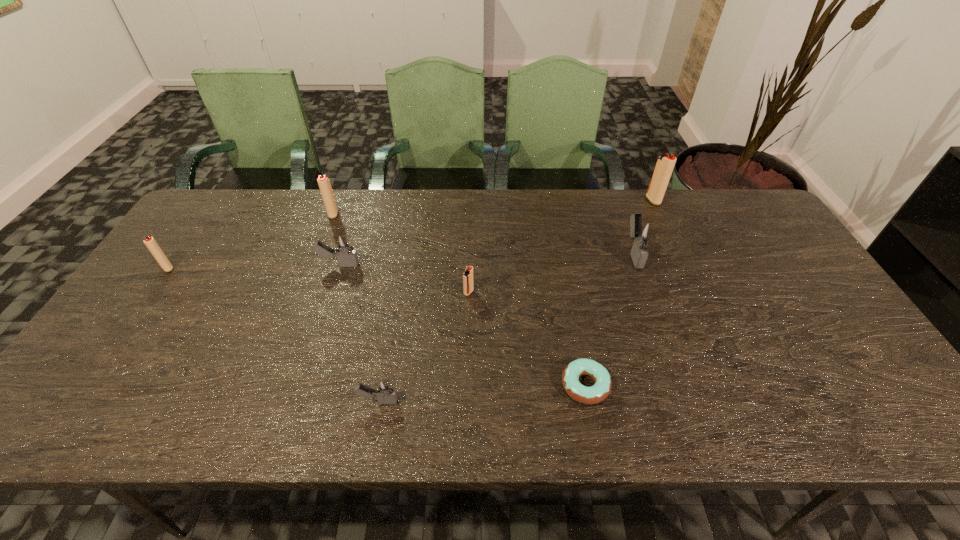
In order to click on free point between the leftmost red igniter and the seventh object from left to right in this screenshot , I will do `click(400, 260)`.

This screenshot has width=960, height=540. In order to click on vacant area that lies between the seventh nearest object and the biggest gray igniter in this screenshot , I will do `click(484, 233)`.

Find the location of a particular element. The image size is (960, 540). empty space that is in between the leftmost igniter and the second farthest red igniter is located at coordinates (251, 241).

Locate an element on the screen. The image size is (960, 540). free space between the seventh nearest object and the third nearest object is located at coordinates (401, 253).

Locate an element on the screen. free space between the nearest igniter and the seventh object from left to right is located at coordinates (506, 327).

Identify the location of free point between the sixth igniter from left to right and the smallest gray igniter. (506, 327).

Identify the location of free spot between the rightmost gray igniter and the second farthest object. (484, 233).

Locate an element on the screen. This screenshot has width=960, height=540. free space between the blue doughnut and the biggest red igniter is located at coordinates (619, 293).

At what (x,y) coordinates should I click in order to perform the action: click on free space between the second biggest gray igniter and the sixth igniter from left to right. Please return your answer as a coordinate pair (x, y). The width and height of the screenshot is (960, 540). Looking at the image, I should click on (486, 259).

Identify which object is the closest to the leftmost red igniter. Please provide its 2D coordinates. Your answer should be formatted as a tuple, i.e. [(x, y)], where the tuple contains the x and y coordinates of a point satisfying the conditions above.

[(346, 255)]